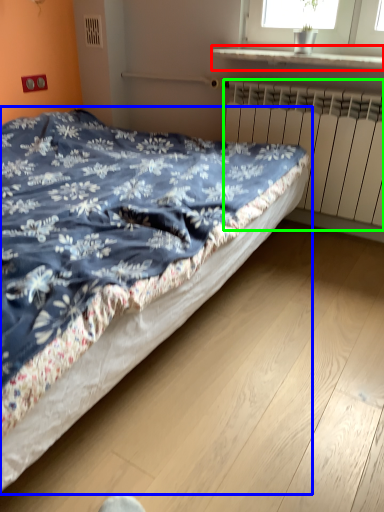
Question: Based on their relative distances, which object is farther from window sill (highlighted by a red box)? Choose from bed (highlighted by a blue box) and radiator (highlighted by a green box).

Choices:
 (A) bed
 (B) radiator

Answer: (A)